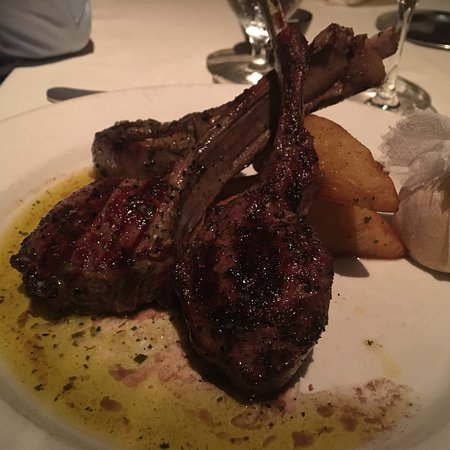
Locate an element on the screen. wine glass stem is located at coordinates [x=403, y=25], [x=266, y=31].